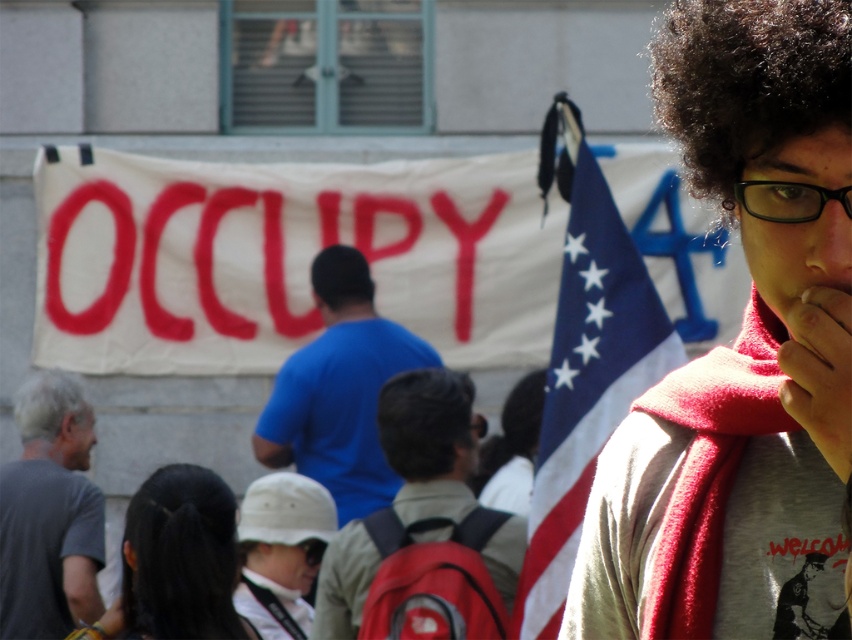
What do you see at coordinates (338, 388) in the screenshot?
I see `blue matte shirt at center` at bounding box center [338, 388].

Is blue matte shirt at center thinner than gray matte t-shirt at left?

Incorrect, blue matte shirt at center's width is not less than gray matte t-shirt at left's.

This screenshot has height=640, width=852. In order to click on blue matte shirt at center in this screenshot , I will do `click(338, 388)`.

Does pink matte nose at center appear over black matte afro at center?

Actually, pink matte nose at center is below black matte afro at center.

Who is positioned more to the left, pink matte nose at center or black matte afro at center?

black matte afro at center is more to the left.

This screenshot has height=640, width=852. Describe the element at coordinates (816, 248) in the screenshot. I see `pink matte nose at center` at that location.

This screenshot has width=852, height=640. Find the location of `pink matte nose at center`. pink matte nose at center is located at coordinates (816, 248).

Who is higher up, blue matte shirt at center or clear plastic glasses at upper right?

clear plastic glasses at upper right

Does point (344, 374) lie behind point (796, 186)?

Yes, it is.

Is point (366, 458) behind point (809, 186)?

Yes, point (366, 458) is farther from viewer.

In order to click on blue matte shirt at center in this screenshot , I will do coord(338,388).